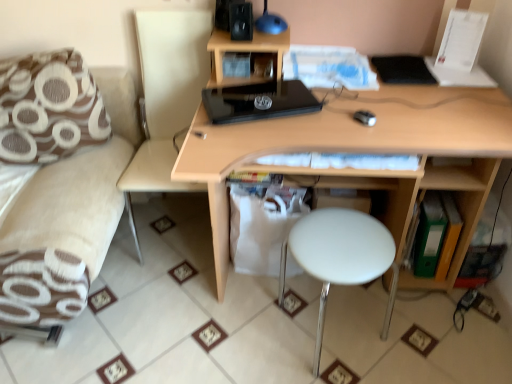
The height and width of the screenshot is (384, 512). Find the location of `vacant area to the left of white glossy stool at center`. vacant area to the left of white glossy stool at center is located at coordinates (238, 332).